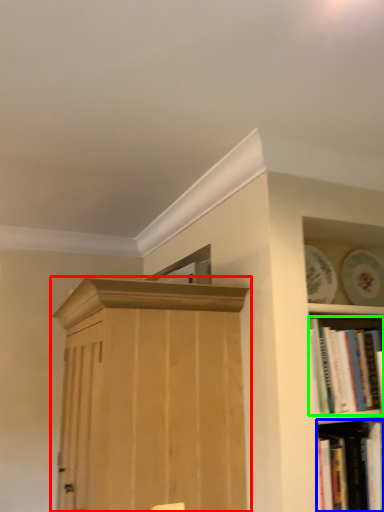
Question: Considering the real-world distances, which object is closest to cupboard (highlighted by a red box)? book (highlighted by a blue box) or book (highlighted by a green box).

Choices:
 (A) book
 (B) book

Answer: (B)